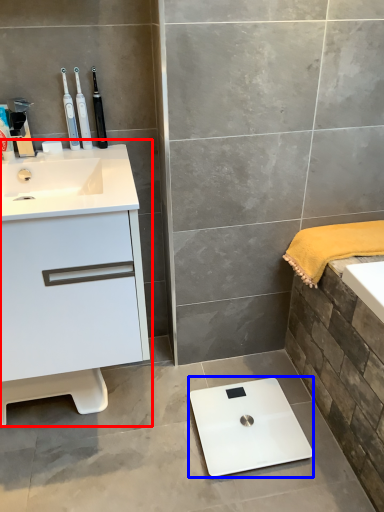
Question: Which point is further to the camera, bathroom cabinet (highlighted by a red box) or scale (highlighted by a blue box)?

Choices:
 (A) bathroom cabinet
 (B) scale

Answer: (B)